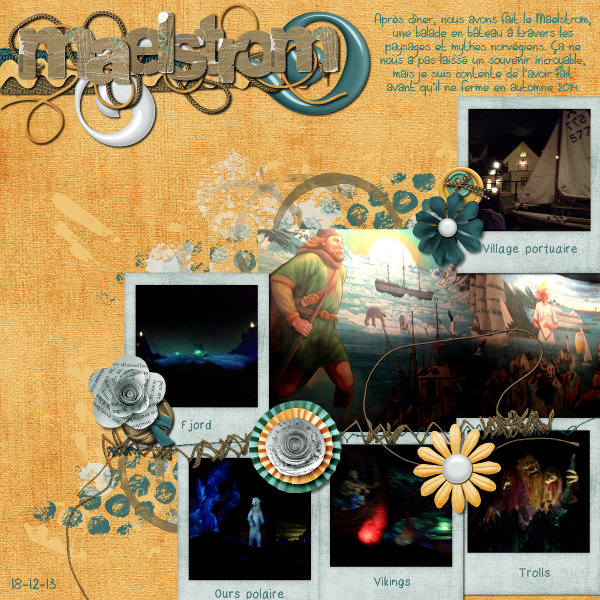
Identify the location of artwork on wall. (422, 365).